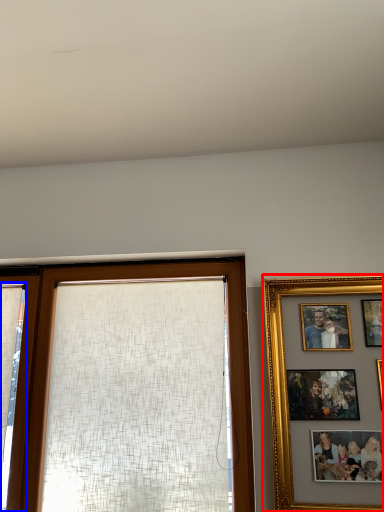
Question: Which point is closer to the camera, picture frame (highlighted by a red box) or curtain (highlighted by a blue box)?

Choices:
 (A) picture frame
 (B) curtain

Answer: (A)